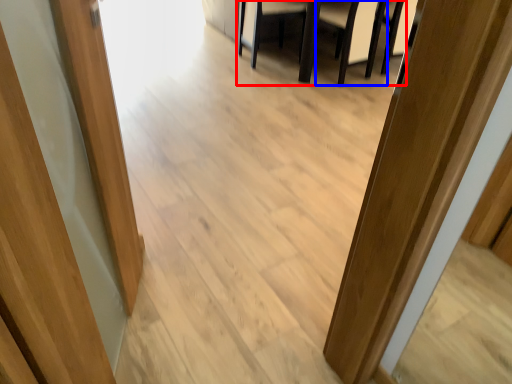
Question: Which of the following is the closest to the observer, furniture (highlighted by a red box) or armchair (highlighted by a blue box)?

Choices:
 (A) furniture
 (B) armchair

Answer: (B)